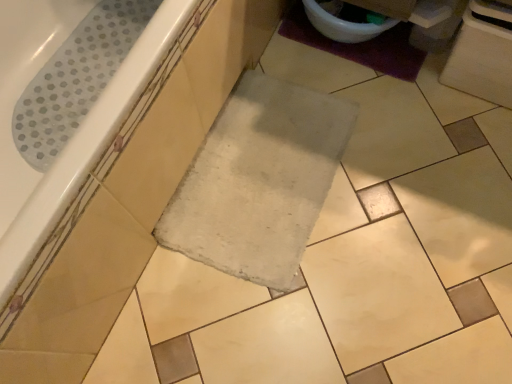
This screenshot has width=512, height=384. Find the location of `free point to the left of purple fuzzy bath mat at upper right`. free point to the left of purple fuzzy bath mat at upper right is located at coordinates (297, 61).